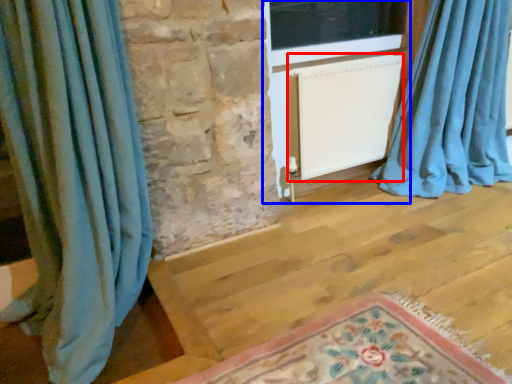
Question: Which object is closer to the camera taking this photo, radiator (highlighted by a red box) or screen door (highlighted by a blue box)?

Choices:
 (A) radiator
 (B) screen door

Answer: (B)